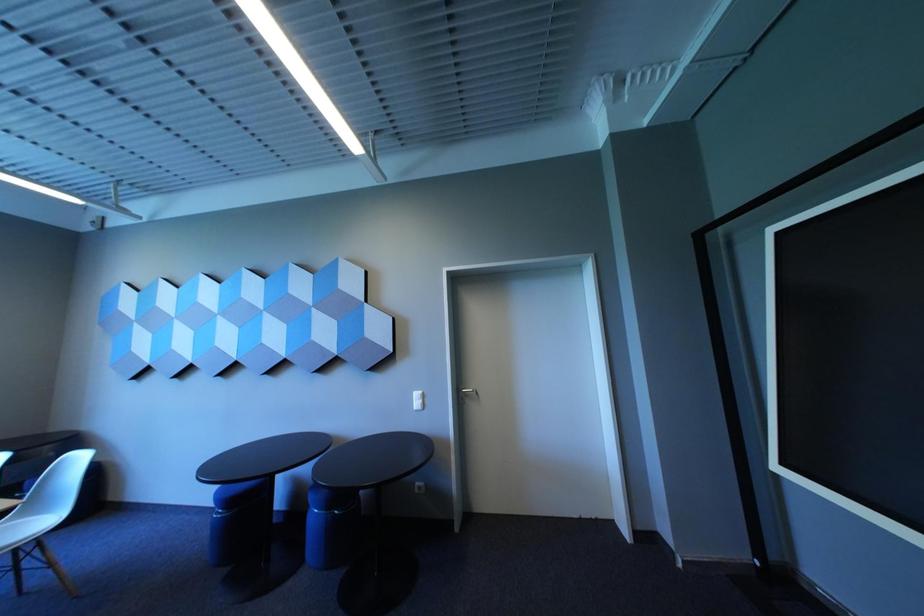
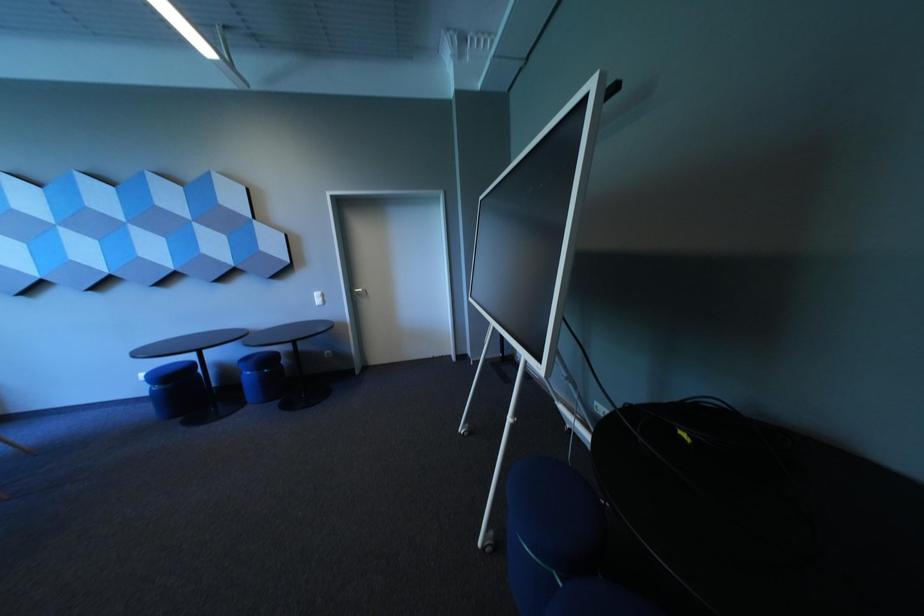
Question: What movement of the cameraman would produce the second image?

Choices:
 (A) Left
 (B) Right
 (C) Forward
 (D) Backward

Answer: (D)